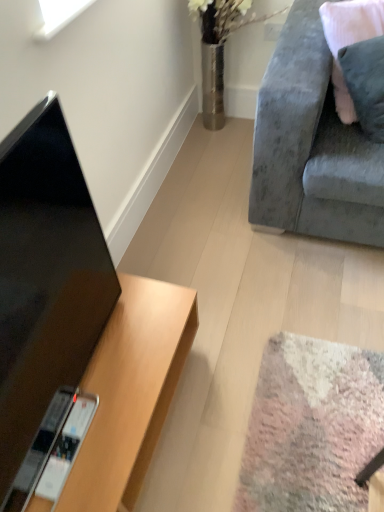
You are a GUI agent. You are given a task and a screenshot of the screen. Output one action in this format:
    pyautogui.click(x=<x>, y=<y>)
    Task: Click on the free point above wooden desk at lower left (from a real-world perspective)
    This screenshot has width=384, height=512.
    Given the screenshot: What is the action you would take?
    pyautogui.click(x=107, y=378)